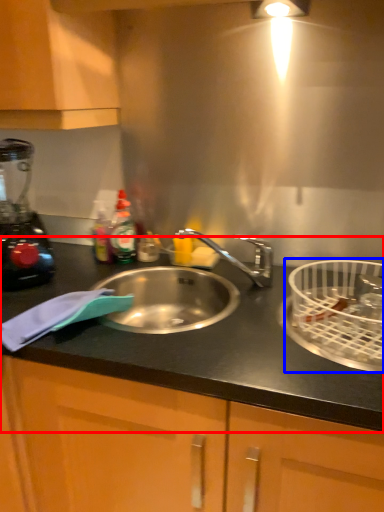
Question: Which of the following is the farthest to the observer, countertop (highlighted by a red box) or basket (highlighted by a blue box)?

Choices:
 (A) countertop
 (B) basket

Answer: (B)